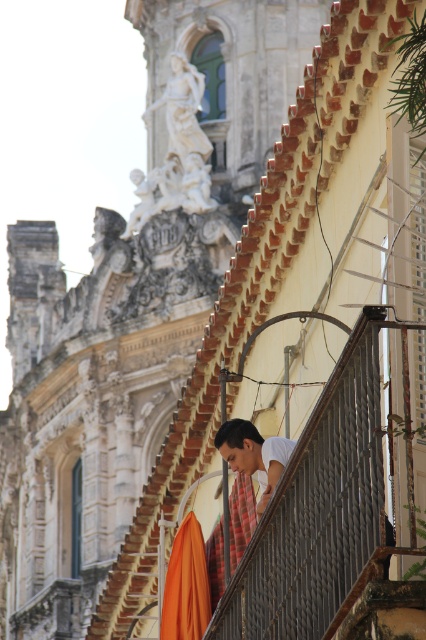
Consider the image. Is orange fabric umbrella at lower center smaller than white matte shirt at center?

Indeed, orange fabric umbrella at lower center has a smaller size compared to white matte shirt at center.

This screenshot has width=426, height=640. Identify the location of orange fabric umbrella at lower center. (186, 584).

Between point (190, 616) and point (264, 460), which one is positioned in front?

Point (264, 460)

What are the coordinates of `orange fabric umbrella at lower center` in the screenshot? It's located at tap(186, 584).